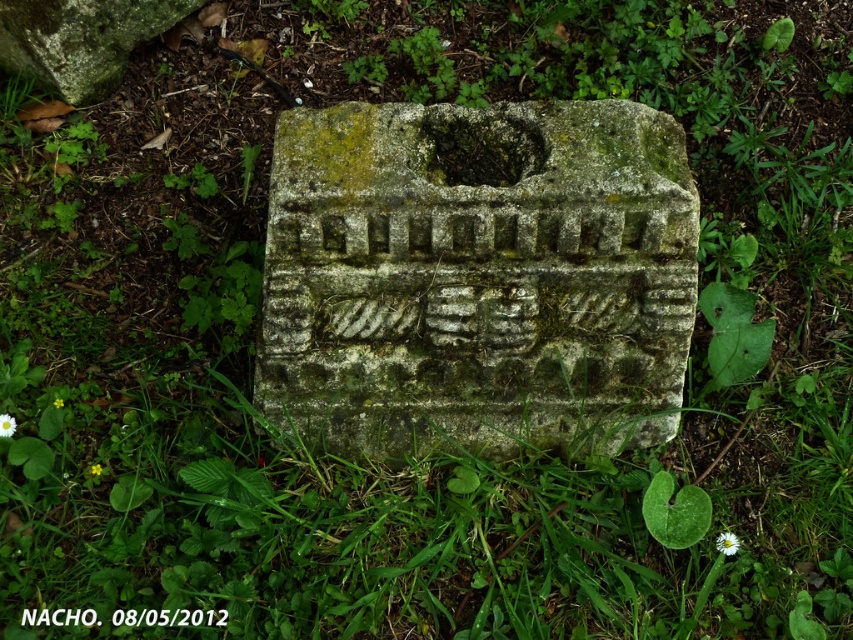
Question: Which object appears closest to the camera in this image?

Choices:
 (A) black paper at center
 (B) green mossy stone at center

Answer: (A)

Question: Does green mossy stone at center appear on the left side of black paper at center?

Choices:
 (A) no
 (B) yes

Answer: (A)

Question: Which point is farther to the camera?

Choices:
 (A) green mossy stone at center
 (B) black paper at center

Answer: (A)

Question: Does green mossy stone at center have a smaller size compared to black paper at center?

Choices:
 (A) yes
 (B) no

Answer: (B)

Question: Can you confirm if green mossy stone at center is positioned above black paper at center?

Choices:
 (A) yes
 (B) no

Answer: (A)

Question: Among these objects, which one is nearest to the camera?

Choices:
 (A) black paper at center
 (B) green mossy stone at center

Answer: (A)